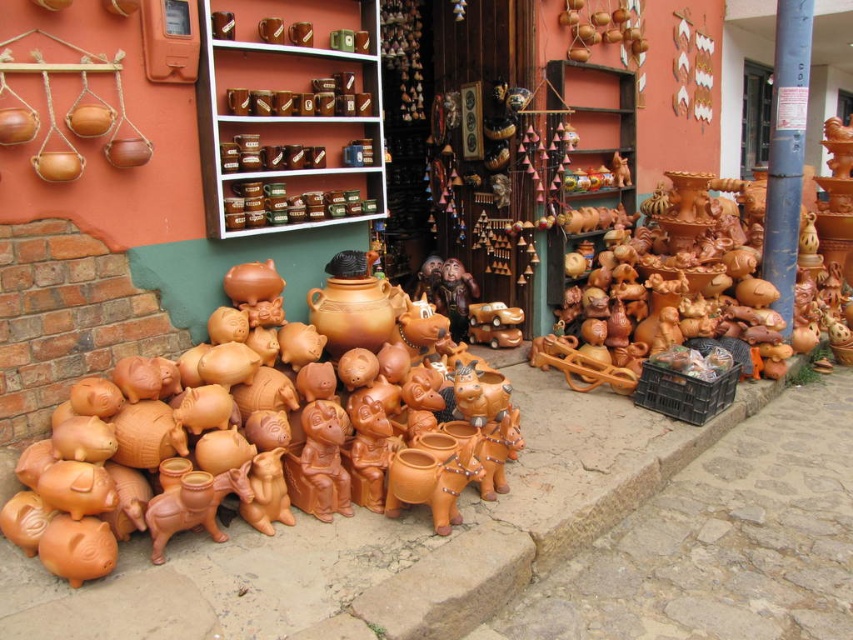
You are a delivery person trying to place a new package on the narrowest object in the scene. Which object should you choose between the blue painted wood pole at upper right and the matte brown boxes at upper center?

The blue painted wood pole at upper right has a lesser width compared to the matte brown boxes at upper center, so you should choose the blue painted wood pole at upper right as it is narrower.

You are a customer browsing the pottery shop and want to pick up the matte ceramic mugs at upper center and the matte brown boxes at upper center. Which item should you reach for first to grab both efficiently?

You should reach for the matte ceramic mugs at upper center first since they are closer to you than the matte brown boxes at upper center, allowing you to grab both items more efficiently.